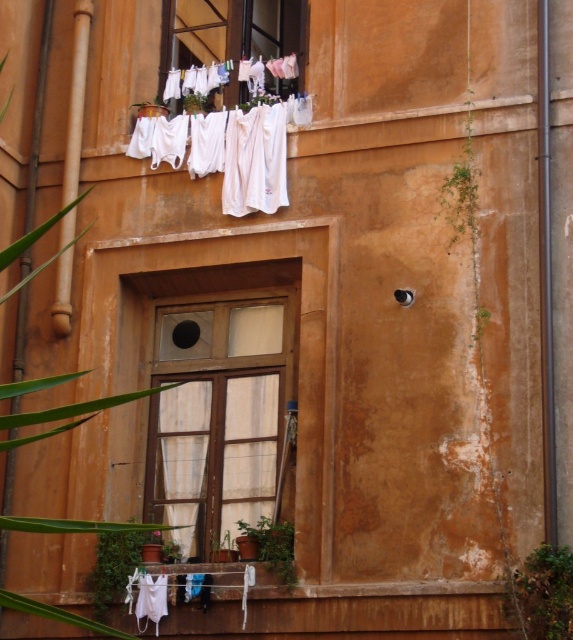
Question: Does wooden frame at center appear under white fabric at upper center?

Choices:
 (A) no
 (B) yes

Answer: (B)

Question: Which point appears closest to the camera in this image?

Choices:
 (A) (198, 468)
 (B) (202, 29)
 (C) (225, 474)

Answer: (C)

Question: Which point is farther from the camera taking this photo?

Choices:
 (A) (203, 412)
 (B) (197, 397)
 (C) (186, 28)

Answer: (C)

Question: Can you confirm if white fabric at upper center is bigger than white sheer curtain at center?

Choices:
 (A) yes
 (B) no

Answer: (B)

Question: Which of the following is the farthest from the observer?

Choices:
 (A) white fabric at upper center
 (B) white sheer curtain at center
 (C) wooden frame at center

Answer: (A)

Question: From the image, what is the correct spatial relationship of wooden frame at center in relation to white fabric at upper center?

Choices:
 (A) left
 (B) right

Answer: (A)